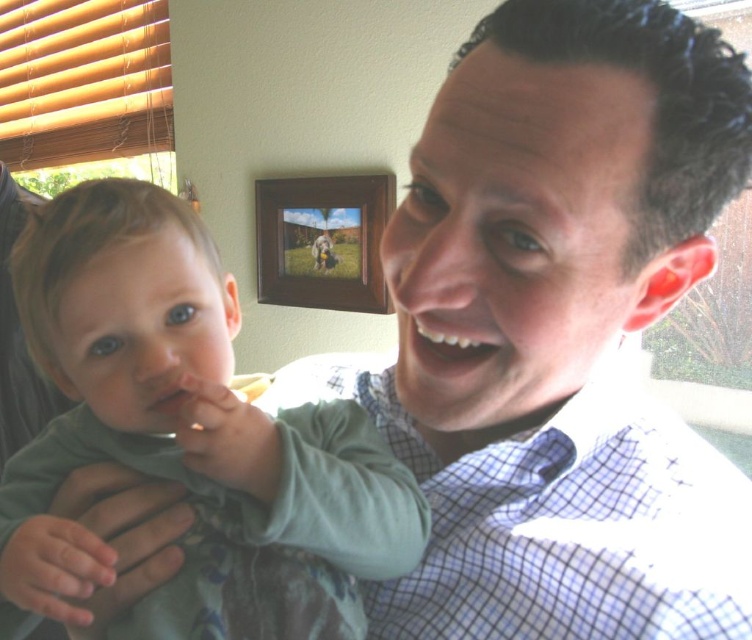
Based on the coordinates provided, where is the green cotton shirt at left located in the image?

The green cotton shirt at left is located at the 2D coordinates point (193, 433) in the image.

You are a dentist examining a patient. You notice the white glossy teeth at center and the pink matte lips at center. Which anatomical feature is located above the other?

The white glossy teeth at center are positioned over the pink matte lips at center, meaning the teeth are above the lips.